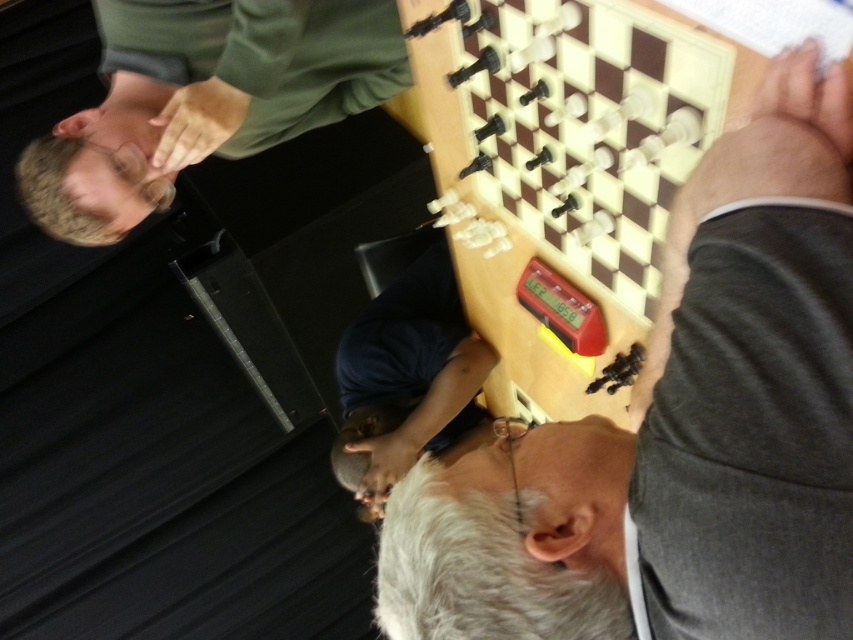
Looking at this image, you are a chess player observing the game. There is a point at coordinates (202, 99) on the chessboard. Which object from the scene does this point belong to?

The point at coordinates (202, 99) belongs to the green matte shirt at upper left.

You are a spectator observing the chess game. The smooth wooden chessboard at upper center and the dark blue shirt at center are both in your view. Which object is closer to you?

The smooth wooden chessboard at upper center is closer to you since it is in front of the dark blue shirt at center.

You are a photographer positioned in front of the chessboard. You need to capture a clear photo of both the green matte shirt at upper left and the dark blue shirt at center. Which shirt will appear larger in the photo?

The green matte shirt at upper left will appear larger in the photo because it is closer to the viewer than the dark blue shirt at center.